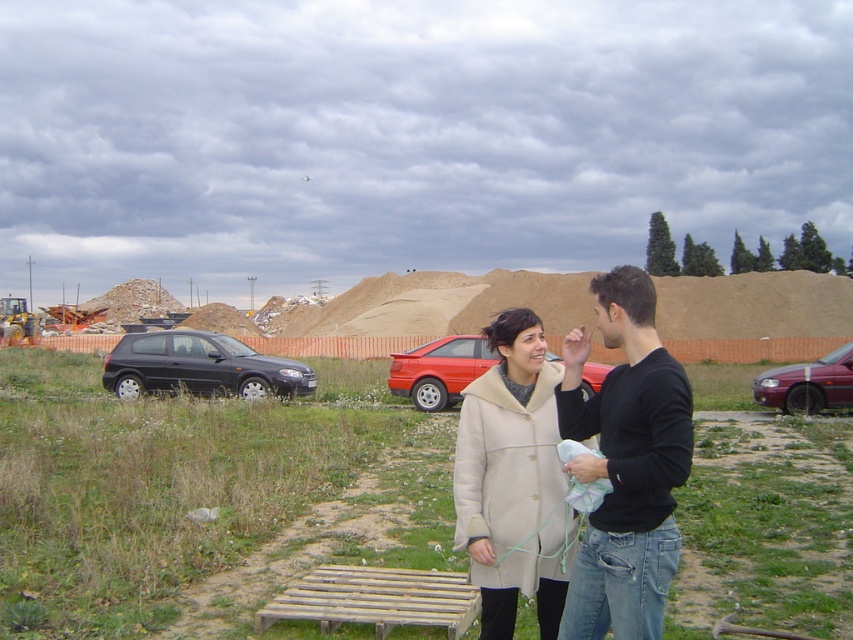
Is matte black hatchback at left shorter than metallic maroon sedan at right?

Correct, matte black hatchback at left is not as tall as metallic maroon sedan at right.

Can you confirm if matte black hatchback at left is positioned to the right of metallic maroon sedan at right?

In fact, matte black hatchback at left is to the left of metallic maroon sedan at right.

The height and width of the screenshot is (640, 853). What are the coordinates of `matte black hatchback at left` in the screenshot? It's located at (200, 365).

Which of these two, wooden bench at center or wooden slats at center, stands shorter?

wooden slats at center

Does wooden bench at center have a greater height compared to wooden slats at center?

Yes.

This screenshot has height=640, width=853. What do you see at coordinates (184, 492) in the screenshot? I see `wooden bench at center` at bounding box center [184, 492].

At what (x,y) coordinates should I click in order to perform the action: click on wooden bench at center. Please return your answer as a coordinate pair (x, y). The height and width of the screenshot is (640, 853). Looking at the image, I should click on (184, 492).

I want to click on wooden bench at center, so click(x=184, y=492).

Which is above, wooden bench at center or beige wool coat at center?

beige wool coat at center is above.

Where is `wooden bench at center`? The height and width of the screenshot is (640, 853). wooden bench at center is located at coordinates pyautogui.click(x=184, y=492).

Where is `wooden bench at center`? wooden bench at center is located at coordinates (184, 492).